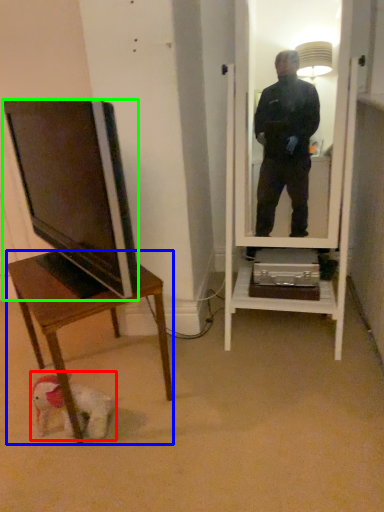
Question: Which object is the farthest from dog (highlighted by a red box)? Choose among these: desk (highlighted by a blue box) or television (highlighted by a green box).

Choices:
 (A) desk
 (B) television

Answer: (B)